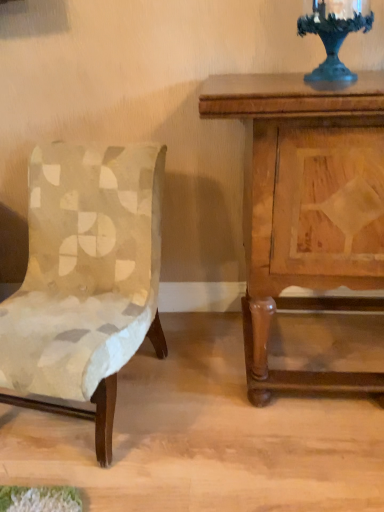
Identify the location of vacant space underneath wooden nightstand at right (from a real-world perspective). The image size is (384, 512). (312, 352).